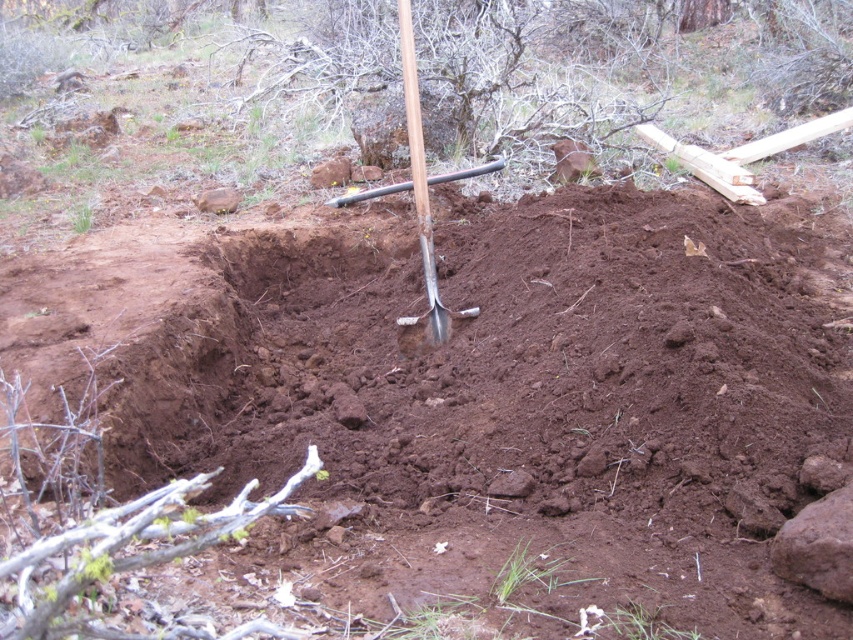
Question: In this image, where is brown soil at center located relative to silver metallic shovel at center?

Choices:
 (A) below
 (B) above

Answer: (A)

Question: Does brown soil at center appear under silver metallic shovel at center?

Choices:
 (A) yes
 (B) no

Answer: (A)

Question: Is brown soil at center to the right of silver metallic shovel at center from the viewer's perspective?

Choices:
 (A) yes
 (B) no

Answer: (A)